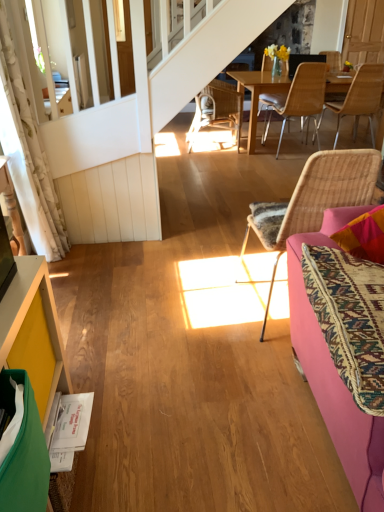
This screenshot has width=384, height=512. In order to click on vacant area that lies between yellow painted wood cabinet at lower left and woven rattan chair at center, the 3th chair positioned from the right in this screenshot , I will do `click(191, 377)`.